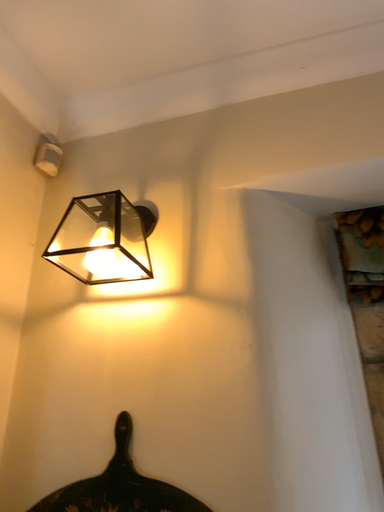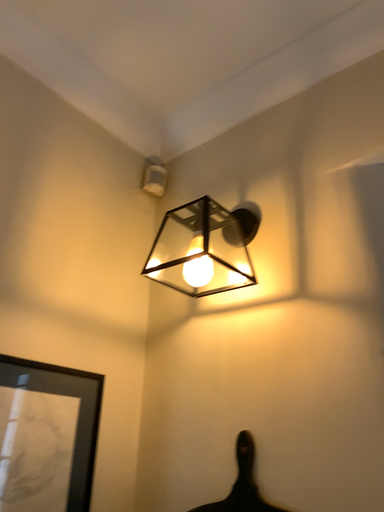
Question: Which way did the camera rotate in the video?

Choices:
 (A) rotated left
 (B) rotated right

Answer: (A)